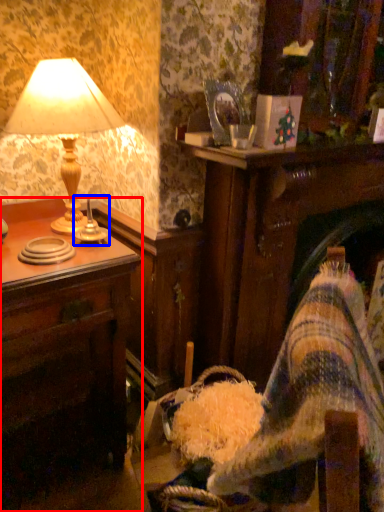
Question: Among these objects, which one is farthest to the camera, desk (highlighted by a red box) or candle holder (highlighted by a blue box)?

Choices:
 (A) desk
 (B) candle holder

Answer: (B)